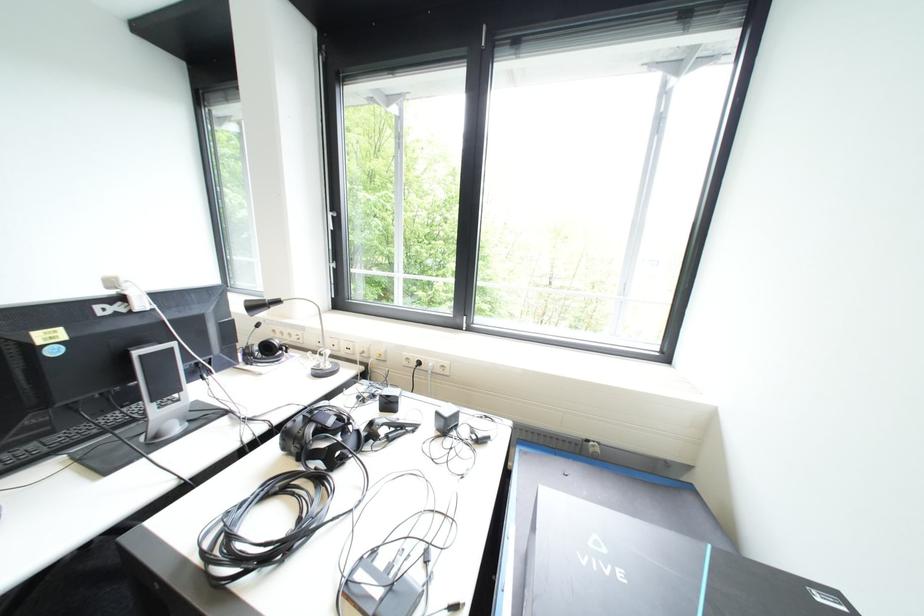
Where is `black headphones`? Image resolution: width=924 pixels, height=616 pixels. black headphones is located at coordinates (321, 436).